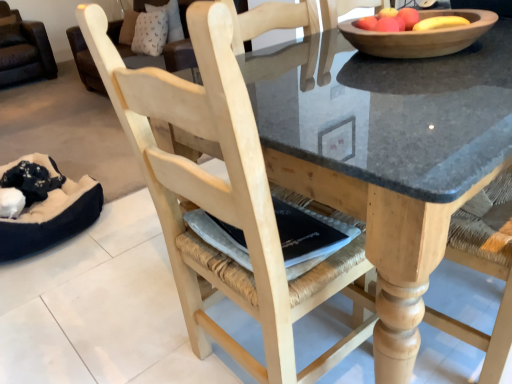
Describe the element at coordinates (221, 197) in the screenshot. This screenshot has height=384, width=512. I see `natural wood chair at center` at that location.

Measure the distance between black plush bean bag at lower left and camera.

The depth of black plush bean bag at lower left is 1.72 meters.

Locate an element on the screen. Image resolution: width=512 pixels, height=384 pixels. natural wood chair at center is located at coordinates (221, 197).

In the scene shown: Considering the positions of objects natural wood table at center and wooden bowl at upper center in the image provided, who is in front, natural wood table at center or wooden bowl at upper center?

natural wood table at center is in front.

Can you confirm if natural wood table at center is positioned to the right of wooden bowl at upper center?

Correct, you'll find natural wood table at center to the right of wooden bowl at upper center.

Does point (344, 44) come behind point (341, 27)?

Yes, it is behind point (341, 27).

Does natural wood table at center have a larger size compared to wooden bowl at upper center?

Correct, natural wood table at center is larger in size than wooden bowl at upper center.

Is black plush bean bag at lower left bigger or smaller than natural wood chair at center?

black plush bean bag at lower left is smaller than natural wood chair at center.

Is black plush bean bag at lower left in front of or behind natural wood chair at center in the image?

black plush bean bag at lower left is positioned farther from the viewer than natural wood chair at center.

Can you confirm if black plush bean bag at lower left is positioned to the left of natural wood chair at center?

Yes.

From a real-world perspective, is black plush bean bag at lower left positioned above or below natural wood chair at center?

black plush bean bag at lower left is below natural wood chair at center.

Is natural wood table at center at the back of wooden bowl at upper center?

That's not correct — wooden bowl at upper center is not looking away from natural wood table at center.

Which of these two, wooden bowl at upper center or natural wood table at center, is bigger?

Bigger between the two is natural wood table at center.

Can you confirm if wooden bowl at upper center is wider than natural wood table at center?

Incorrect, the width of wooden bowl at upper center does not surpass that of natural wood table at center.

From the image's perspective, which one is positioned lower, natural wood chair at center or black plush bean bag at lower left?

natural wood chair at center, from the image's perspective.

Considering the sizes of natural wood chair at center and black plush bean bag at lower left in the image, is natural wood chair at center wider or thinner than black plush bean bag at lower left?

In the image, natural wood chair at center appears to be more narrow than black plush bean bag at lower left.

In the scene shown: From a real-world perspective, which object rests below the other?

From a 3D spatial view, black plush bean bag at lower left is below.

Is natural wood chair at center bigger or smaller than black plush bean bag at lower left?

natural wood chair at center is bigger than black plush bean bag at lower left.

Which object is positioned more to the left, wooden bowl at upper center or natural wood chair at center?

natural wood chair at center is more to the left.

Is point (457, 13) farther from camera compared to point (170, 77)?

Yes.

Can you tell me how much wooden bowl at upper center and natural wood chair at center differ in facing direction?

1.81 degrees.

Considering the relative sizes of natural wood table at center and natural wood chair at center in the image provided, is natural wood table at center taller than natural wood chair at center?

Incorrect, the height of natural wood table at center is not larger of that of natural wood chair at center.

Between point (421, 177) and point (165, 171), which one is positioned behind?

The point (165, 171) is behind.

Could you tell me if natural wood table at center is turned towards natural wood chair at center?

No, natural wood table at center does not turn towards natural wood chair at center.

Which is in front, point (218, 332) or point (457, 208)?

The point (457, 208) is closer.

Are natural wood chair at center and natural wood table at center beside each other?

No, natural wood chair at center is not beside natural wood table at center.

Would you say natural wood chair at center contains natural wood table at center?

Actually, natural wood table at center is outside natural wood chair at center.

Looking at this image, who is bigger, natural wood chair at center or natural wood table at center?

With larger size is natural wood table at center.

The width and height of the screenshot is (512, 384). Find the location of `bowl that appears above the natural wood table at center (from a real-world perspective)`. bowl that appears above the natural wood table at center (from a real-world perspective) is located at coordinates [x=421, y=36].

Where is `chair on the right of black plush bean bag at lower left`? This screenshot has width=512, height=384. chair on the right of black plush bean bag at lower left is located at coordinates (221, 197).

Estimate the real-world distances between objects in this image. Which object is further from natural wood chair at center, natural wood table at center or wooden bowl at upper center?

Among the two, wooden bowl at upper center is located further to natural wood chair at center.

From the image, which object appears to be farther from natural wood chair at center, natural wood table at center or black plush bean bag at lower left?

Among the two, black plush bean bag at lower left is located further to natural wood chair at center.

Looking at the image, which one is located closer to black plush bean bag at lower left, natural wood chair at center or natural wood table at center?

natural wood chair at center is positioned closer to the anchor black plush bean bag at lower left.

Which object lies further to the anchor point black plush bean bag at lower left, wooden bowl at upper center or natural wood chair at center?

wooden bowl at upper center.

Looking at the image, which one is located closer to natural wood chair at center, black plush bean bag at lower left or wooden bowl at upper center?

Among the two, wooden bowl at upper center is located nearer to natural wood chair at center.

Estimate the real-world distances between objects in this image. Which object is further from black plush bean bag at lower left, wooden bowl at upper center or natural wood table at center?

wooden bowl at upper center is further to black plush bean bag at lower left.

Estimate the real-world distances between objects in this image. Which object is closer to black plush bean bag at lower left, natural wood table at center or wooden bowl at upper center?

natural wood table at center is closer to black plush bean bag at lower left.

From the image, which object appears to be nearer to wooden bowl at upper center, black plush bean bag at lower left or natural wood table at center?

Based on the image, natural wood table at center appears to be nearer to wooden bowl at upper center.

This screenshot has height=384, width=512. I want to click on bowl between black plush bean bag at lower left and natural wood table at center in the horizontal direction, so click(421, 36).

The height and width of the screenshot is (384, 512). Find the location of `bowl between natural wood chair at center and natural wood table at center from left to right`. bowl between natural wood chair at center and natural wood table at center from left to right is located at coordinates (421, 36).

Locate an element on the screen. chair situated between black plush bean bag at lower left and wooden bowl at upper center from left to right is located at coordinates (221, 197).

Image resolution: width=512 pixels, height=384 pixels. In order to click on chair between black plush bean bag at lower left and natural wood table at center in the horizontal direction in this screenshot , I will do `click(221, 197)`.